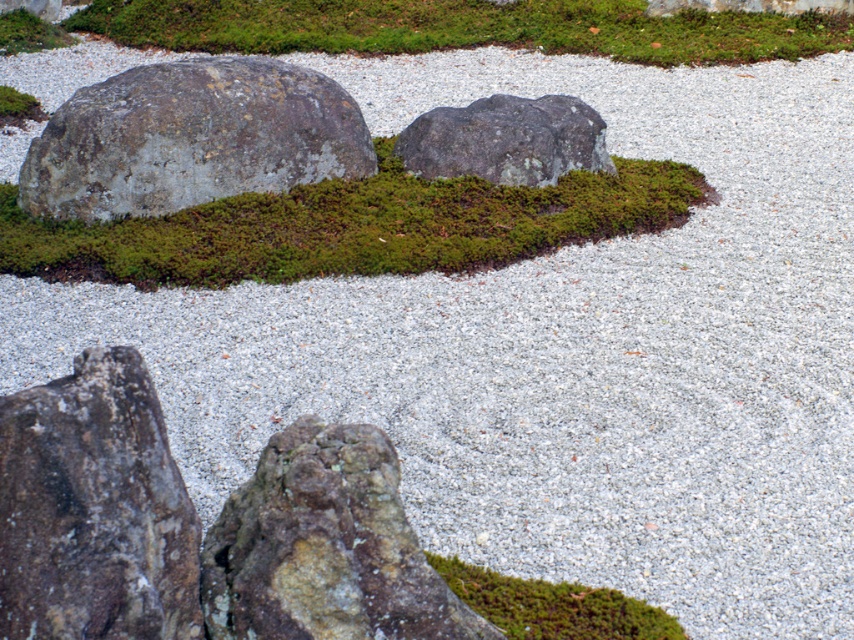
You are a gardener who wants to trim the green moss at upper center and the green moss at center. Which one do you need to trim more because it is taller?

The green moss at upper center needs to be trimmed more because it is much taller than the green moss at center.

You are standing in the Japanese rock garden and want to touch both the green mossy rock at lower left and the rough gray rock at center. Which rock should you reach for first to touch the one closer to you?

The green mossy rock at lower left is closer to the viewer, so you should reach for it first.

You are a gardener tasked with maintaining the Japanese rock garden. You notice two patches of green moss at upper center and green moss at center. Which one is located above the other?

The green moss at upper center is positioned over the green moss at center.